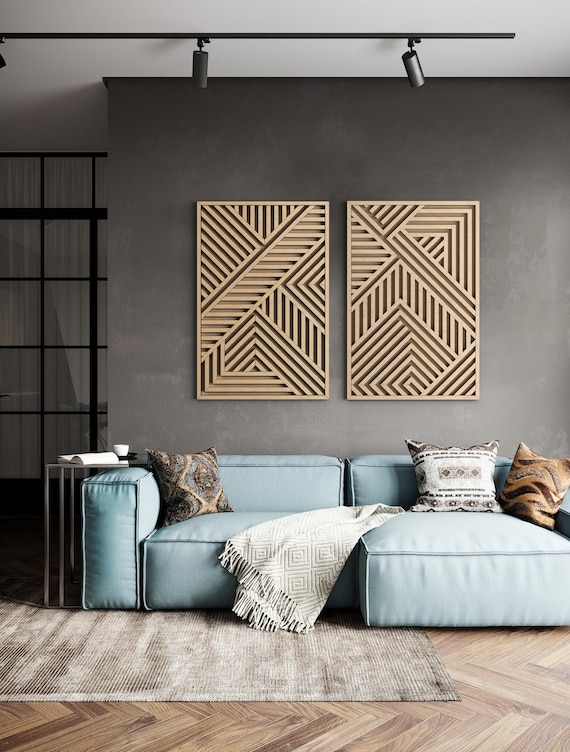
The width and height of the screenshot is (570, 752). Find the location of `white curtains`. white curtains is located at coordinates (57, 320).